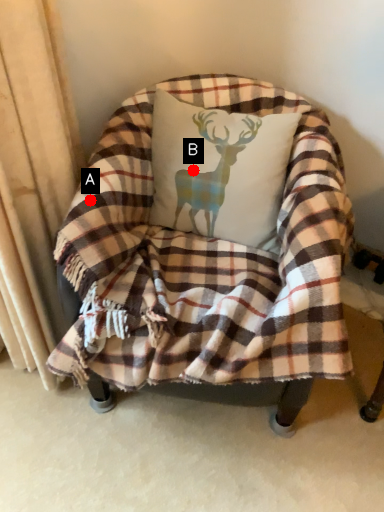
Question: Two points are circled on the image, labeled by A and B beside each circle. Which point appears closest to the camera in this image?

Choices:
 (A) A is closer
 (B) B is closer

Answer: (A)